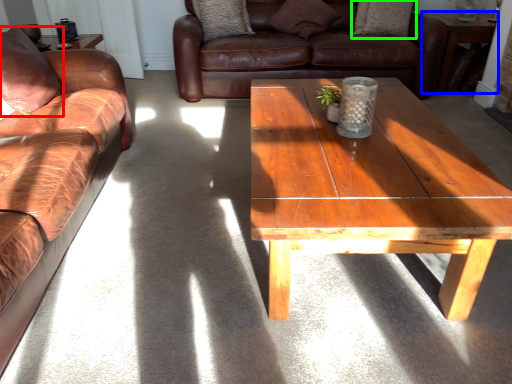
Question: Estimate the real-world distances between objects in this image. Which object is closer to pillow (highlighted by a red box), table (highlighted by a blue box) or pillow (highlighted by a green box)?

Choices:
 (A) table
 (B) pillow

Answer: (B)